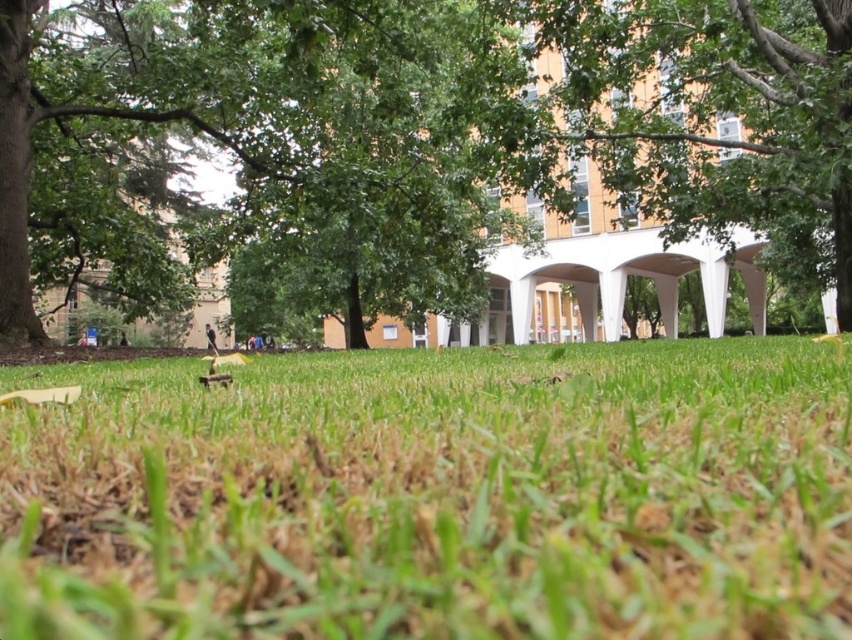
Is point (671, 561) positioned behind point (688, 157)?

That is False.

Between point (262, 579) and point (648, 16), which one is positioned behind?

Positioned behind is point (648, 16).

The height and width of the screenshot is (640, 852). I want to click on green grass at center, so click(435, 493).

Locate an element on the screen. The image size is (852, 640). green grass at center is located at coordinates (435, 493).